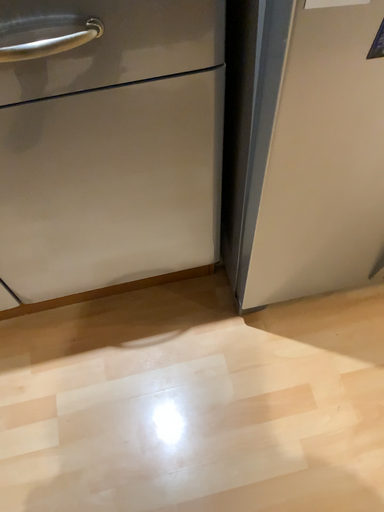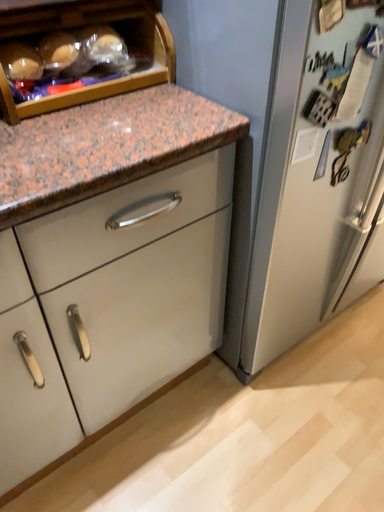
Question: Which way did the camera rotate in the video?

Choices:
 (A) rotated downward
 (B) rotated upward

Answer: (B)